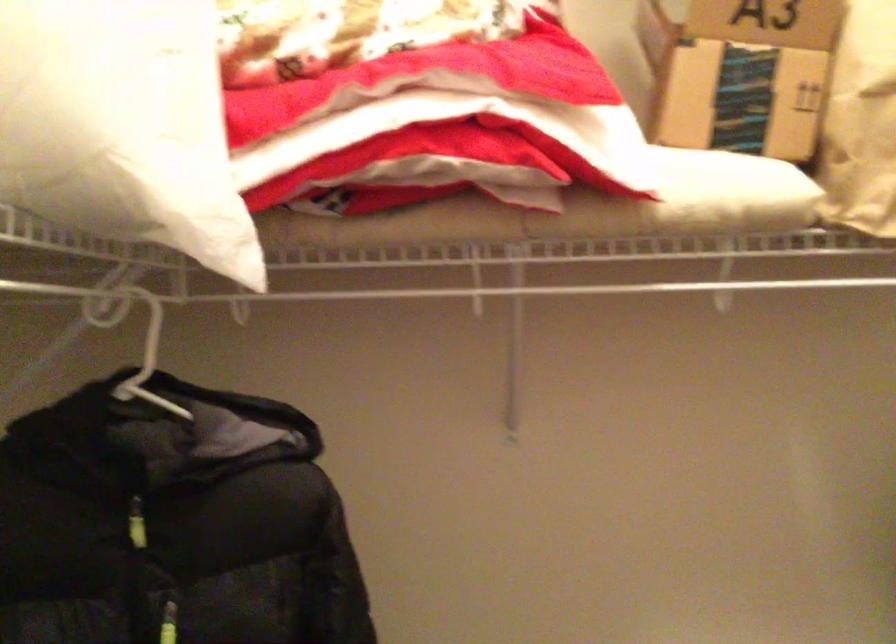
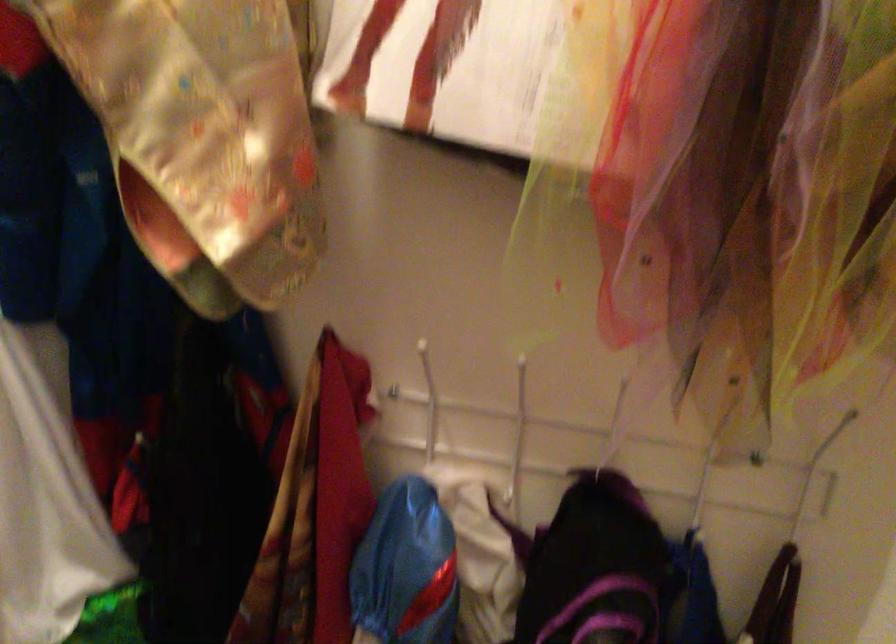
Based on the continuous images, in which direction is the camera rotating?

The rotation direction of the camera is right-down.